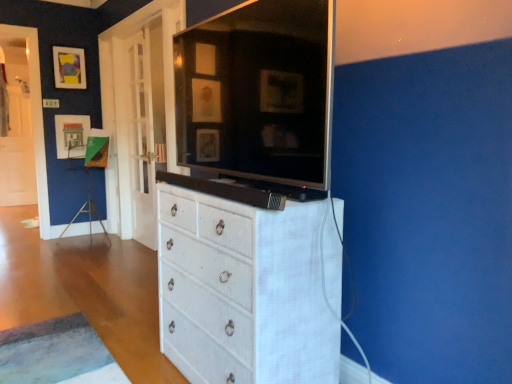
Question: From the image's perspective, is matte paper picture frame at upper left, which is the second picture frame from top to bottom, above or below white textured cabinet at center?

Choices:
 (A) below
 (B) above

Answer: (B)

Question: Considering the positions of matte paper picture frame at upper left, which is the second picture frame from top to bottom, and white textured cabinet at center in the image, is matte paper picture frame at upper left, which is the second picture frame from top to bottom, taller or shorter than white textured cabinet at center?

Choices:
 (A) short
 (B) tall

Answer: (A)

Question: Estimate the real-world distances between objects in this image. Which object is closer to the white wicker chest of drawers at center?

Choices:
 (A) white glass door at left
 (B) matte paper picture frame at upper left, which appears as the first picture frame when ordered from the bottom
 (C) white textured cabinet at center
 (D) matte black picture frame at upper left, which is the 2th picture frame from bottom to top

Answer: (C)

Question: Considering the real-world distances, which object is closest to the white wicker chest of drawers at center?

Choices:
 (A) matte paper picture frame at upper left, which is the second picture frame from top to bottom
 (B) white glass door at left
 (C) white textured cabinet at center
 (D) matte black picture frame at upper left, marked as the first picture frame in a top-to-bottom arrangement

Answer: (C)